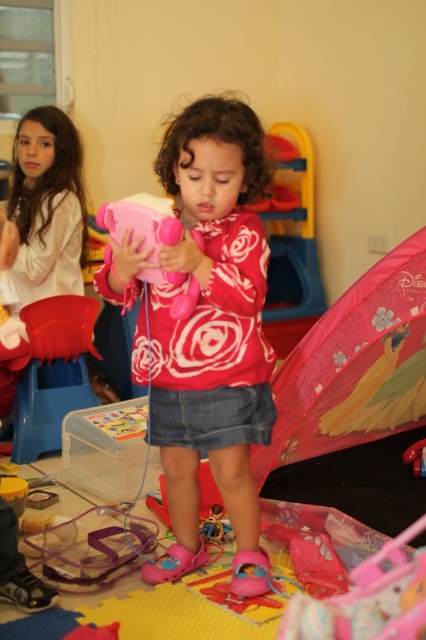
Question: Does pink matte toy phone at center appear on the left side of rubberized pink sandals at lower center?

Choices:
 (A) yes
 (B) no

Answer: (B)

Question: Is the position of rubberized pink sandals at lower center less distant than that of matte pink toy at center?

Choices:
 (A) no
 (B) yes

Answer: (A)

Question: Is pink matte toy phone at center thinner than rubberized pink sandals at lower center?

Choices:
 (A) yes
 (B) no

Answer: (B)

Question: Among these objects, which one is nearest to the camera?

Choices:
 (A) matte pink toy at center
 (B) rubberized pink sandals at lower center
 (C) pink matte toy phone at center

Answer: (A)

Question: Based on their relative distances, which object is farther from the rubberized pink sandals at lower center?

Choices:
 (A) pink matte toy phone at center
 (B) matte pink toy at center

Answer: (B)

Question: Among these objects, which one is farthest from the camera?

Choices:
 (A) pink matte toy phone at center
 (B) rubberized pink sandals at lower center
 (C) matte pink toy at center

Answer: (B)